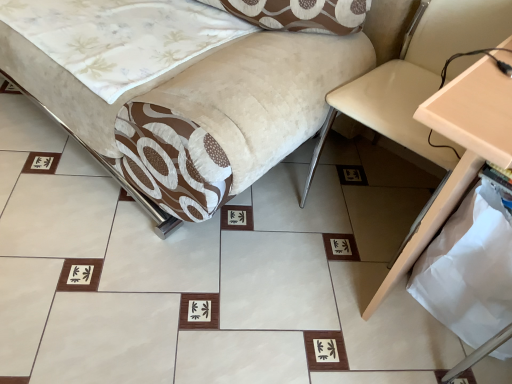
The width and height of the screenshot is (512, 384). What are the coordinates of `vacant space to the left of beige leather swivel chair at right` in the screenshot? It's located at (278, 207).